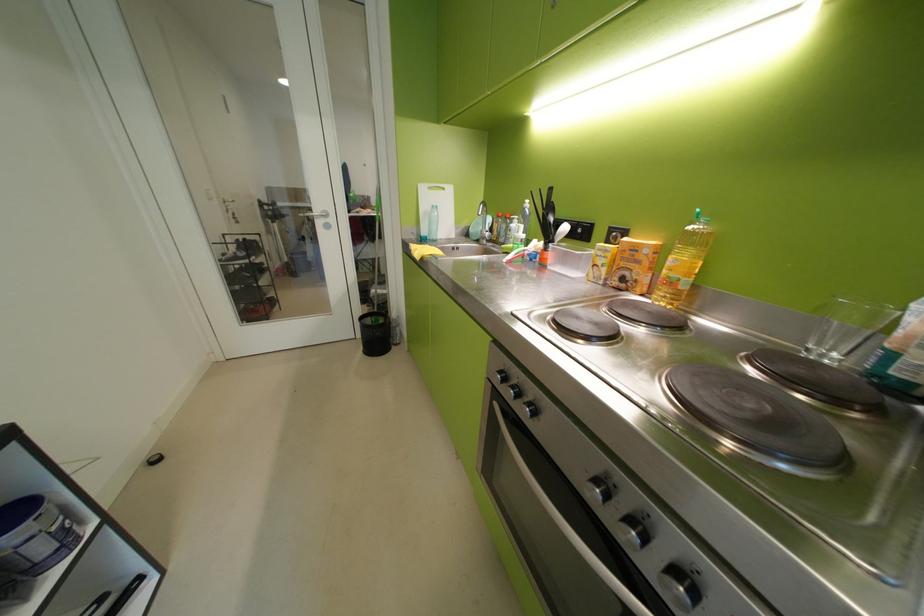
You are a GUI agent. You are given a task and a screenshot of the screen. Output one action in this format:
    pyautogui.click(x=<x>, y=<y>)
    Task: Click on the yellow oil bottle
    The width and height of the screenshot is (924, 616).
    Given the screenshot: What is the action you would take?
    pyautogui.click(x=684, y=262)